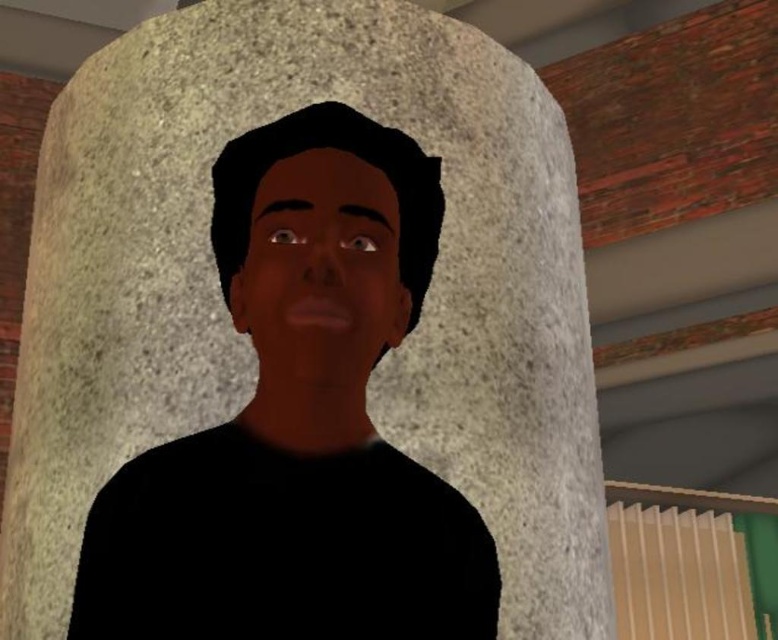
The height and width of the screenshot is (640, 778). Describe the element at coordinates (300, 422) in the screenshot. I see `matte black man at center` at that location.

Does matte black man at center have a smaller size compared to smooth skin face at center?

No, matte black man at center is not smaller than smooth skin face at center.

Identify the location of matte black man at center. This screenshot has width=778, height=640. (300, 422).

What do you see at coordinates (300, 422) in the screenshot? I see `matte black man at center` at bounding box center [300, 422].

Does matte black man at center have a smaller size compared to beige plastic radiator at lower right?

Indeed, matte black man at center has a smaller size compared to beige plastic radiator at lower right.

Between point (230, 300) and point (722, 560), which one is positioned in front?

Point (230, 300)

Locate an element on the screen. matte black man at center is located at coordinates tap(300, 422).

Is smooth skin face at center closer to camera compared to beige plastic radiator at lower right?

That is True.

Who is more distant from viewer, (293,314) or (727,605)?

The point (727,605) is behind.

Where is `smooth skin face at center`? The height and width of the screenshot is (640, 778). smooth skin face at center is located at coordinates (321, 272).

Image resolution: width=778 pixels, height=640 pixels. In order to click on smooth skin face at center in this screenshot , I will do `click(321, 272)`.